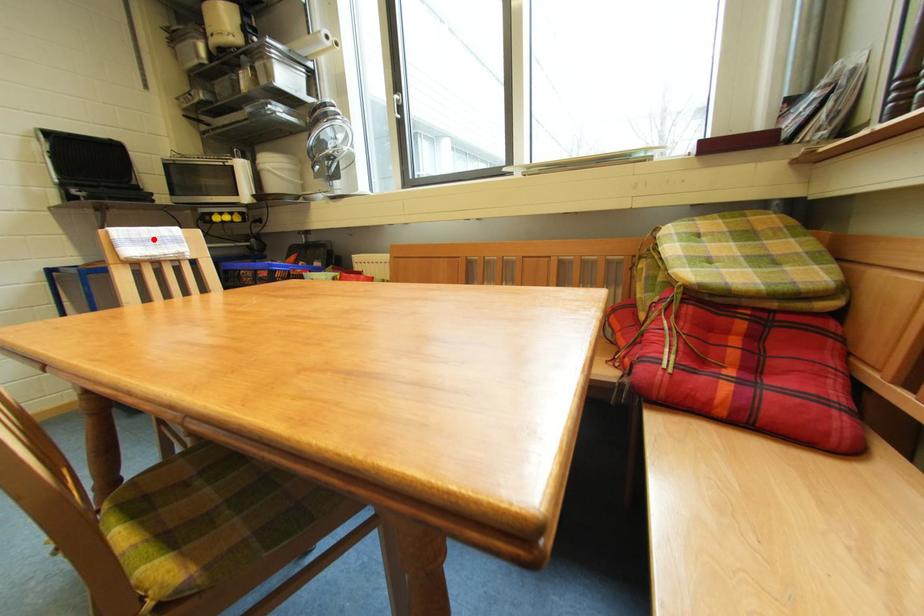
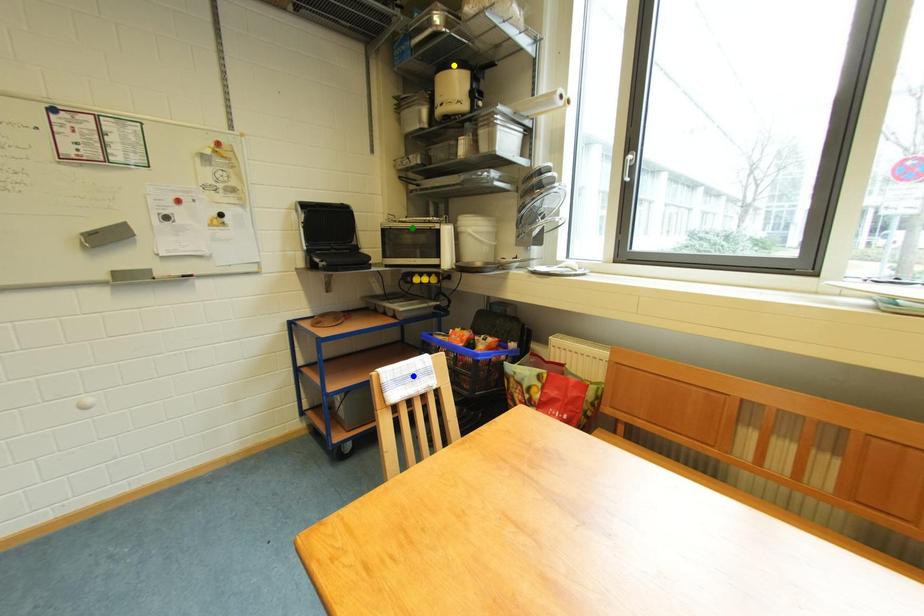
Question: I am providing you with two images of the same scene from different viewpoints. A red point is marked on the first image. You are given multiple points on the second image. Which point in image 2 represents the same 3d spot as the red point in image 1?

Choices:
 (A) yellow point
 (B) blue point
 (C) green point

Answer: (B)